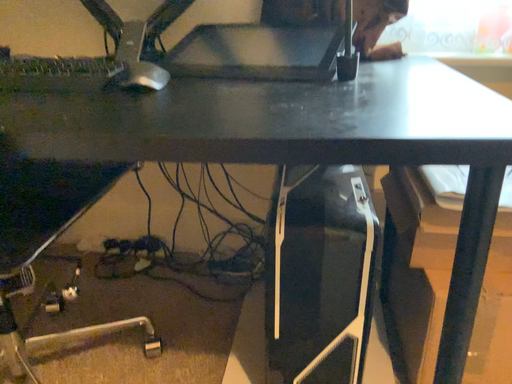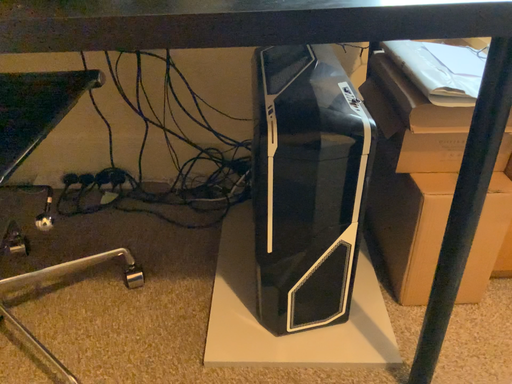
Question: How did the camera likely rotate when shooting the video?

Choices:
 (A) rotated upward
 (B) rotated downward

Answer: (B)